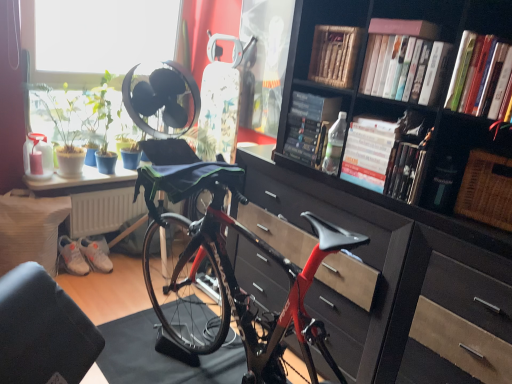
Question: Considering the relative sizes of white matte sneakers at lower left, which appears as the 2th sneakers when viewed from the left, and woven brown picnic basket at right in the image provided, is white matte sneakers at lower left, which appears as the 2th sneakers when viewed from the left, wider than woven brown picnic basket at right?

Choices:
 (A) yes
 (B) no

Answer: (B)

Question: Would you say woven brown picnic basket at right is part of white matte sneakers at lower left, which appears as the 2th sneakers when viewed from the left,'s contents?

Choices:
 (A) no
 (B) yes

Answer: (A)

Question: From the image's perspective, is white matte sneakers at lower left, which ranks as the 1th sneakers in right-to-left order, above woven brown picnic basket at right?

Choices:
 (A) yes
 (B) no

Answer: (B)

Question: Does white matte sneakers at lower left, which ranks as the 1th sneakers in right-to-left order, appear on the right side of woven brown picnic basket at right?

Choices:
 (A) yes
 (B) no

Answer: (B)

Question: Is white matte sneakers at lower left, which ranks as the 1th sneakers in right-to-left order, positioned in front of woven brown picnic basket at right?

Choices:
 (A) no
 (B) yes

Answer: (A)

Question: Is white matte sneakers at lower left, which appears as the 2th sneakers when viewed from the left, shorter than woven brown picnic basket at right?

Choices:
 (A) yes
 (B) no

Answer: (A)

Question: Can wooden book at upper center, positioned as the second book in back-to-front order, be found inside matte black chest of drawers at center?

Choices:
 (A) yes
 (B) no

Answer: (B)

Question: From a real-world perspective, is matte black chest of drawers at center physically below wooden book at upper center, positioned as the second book in back-to-front order?

Choices:
 (A) no
 (B) yes

Answer: (B)

Question: From a real-world perspective, is matte black chest of drawers at center positioned over wooden book at upper center, which appears as the sixth book when viewed from the front, based on gravity?

Choices:
 (A) yes
 (B) no

Answer: (B)

Question: Can you confirm if matte black chest of drawers at center is thinner than wooden book at upper center, which appears as the sixth book when viewed from the front?

Choices:
 (A) no
 (B) yes

Answer: (A)

Question: From the image's perspective, is matte black chest of drawers at center located above wooden book at upper center, which appears as the sixth book when viewed from the front?

Choices:
 (A) yes
 (B) no

Answer: (B)

Question: Is matte black chest of drawers at center with wooden book at upper center, which appears as the sixth book when viewed from the front?

Choices:
 (A) no
 (B) yes

Answer: (A)

Question: From a real-world perspective, is white matte book at upper center, placed as the 2th book when sorted from front to back, beneath hardcover book at center, which ranks as the fourth book in back-to-front order?

Choices:
 (A) yes
 (B) no

Answer: (B)